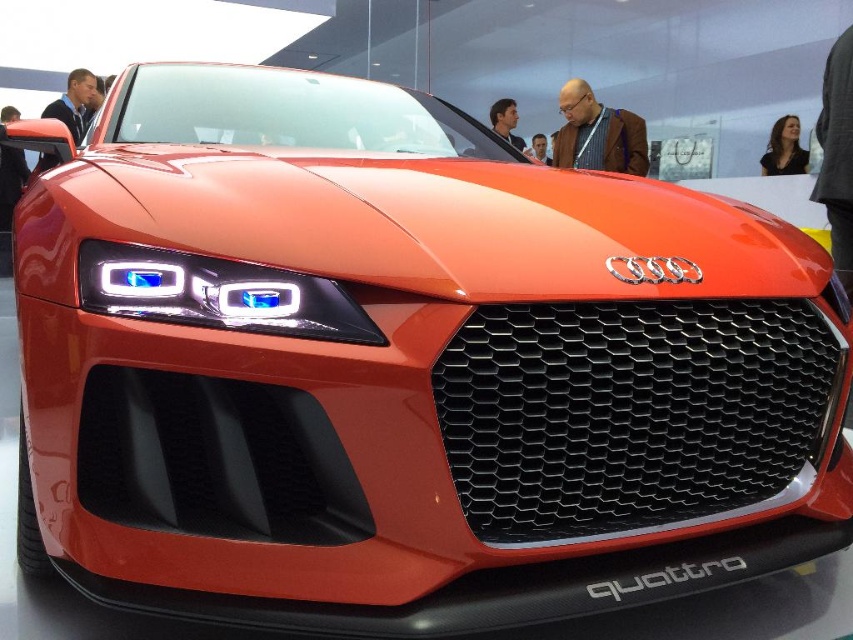
Question: Is the position of matte plastic headlight at center more distant than that of shiny orange car at center?

Choices:
 (A) yes
 (B) no

Answer: (B)

Question: Considering the relative positions of matte plastic headlight at center and shiny orange car at center in the image provided, where is matte plastic headlight at center located with respect to shiny orange car at center?

Choices:
 (A) below
 (B) above

Answer: (A)

Question: Among these objects, which one is nearest to the camera?

Choices:
 (A) matte plastic headlight at center
 (B) shiny orange car at center

Answer: (A)

Question: Is matte plastic headlight at center thinner than shiny orange car at center?

Choices:
 (A) yes
 (B) no

Answer: (A)

Question: Among these objects, which one is nearest to the camera?

Choices:
 (A) shiny orange car at center
 (B) matte plastic headlight at center

Answer: (B)

Question: Which of the following is the farthest from the observer?

Choices:
 (A) (142, 294)
 (B) (769, 172)

Answer: (B)